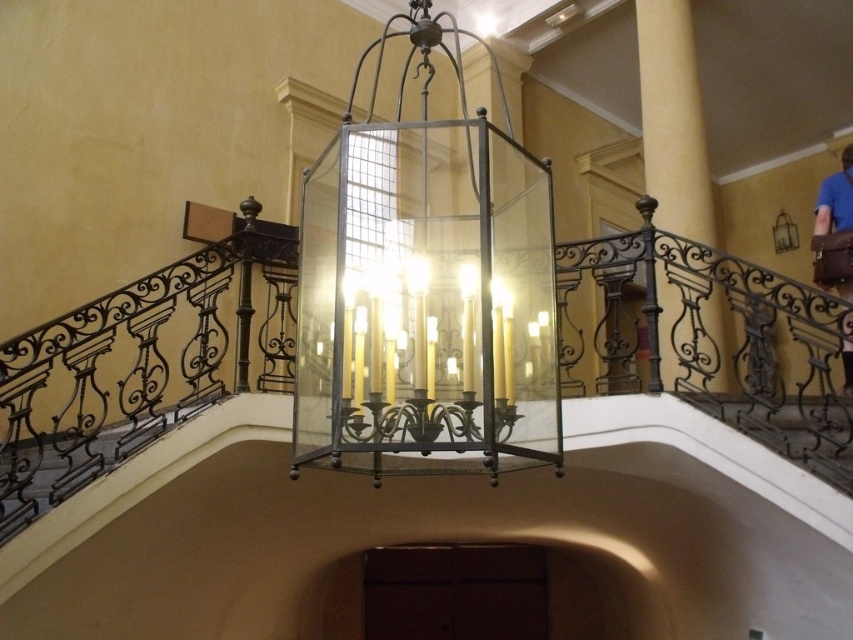
Can you confirm if clear glass lantern at center is bigger than metallic wrought iron at lower right?

Indeed, clear glass lantern at center has a larger size compared to metallic wrought iron at lower right.

Does point (467, 138) lie behind point (811, 472)?

No.

What do you see at coordinates (425, 291) in the screenshot? I see `clear glass lantern at center` at bounding box center [425, 291].

Where is `clear glass lantern at center`? clear glass lantern at center is located at coordinates (425, 291).

Is wrought iron railing at left to the left of blue leather bag at right from the viewer's perspective?

Yes, wrought iron railing at left is to the left of blue leather bag at right.

Can you confirm if wrought iron railing at left is shorter than blue leather bag at right?

Correct, wrought iron railing at left is not as tall as blue leather bag at right.

Is point (169, 404) positioned after point (822, 284)?

No, (169, 404) is in front of (822, 284).

Locate an element on the screen. This screenshot has width=853, height=640. wrought iron railing at left is located at coordinates (85, 454).

Who is positioned more to the right, metallic wrought iron at lower right or blue leather bag at right?

Positioned to the right is blue leather bag at right.

How much distance is there between metallic wrought iron at lower right and blue leather bag at right?

A distance of 1.79 meters exists between metallic wrought iron at lower right and blue leather bag at right.

Is point (827, 412) closer to viewer compared to point (815, 224)?

Yes, it is in front of point (815, 224).

Find the location of a particular element. Image resolution: width=853 pixels, height=640 pixels. metallic wrought iron at lower right is located at coordinates coord(788,426).